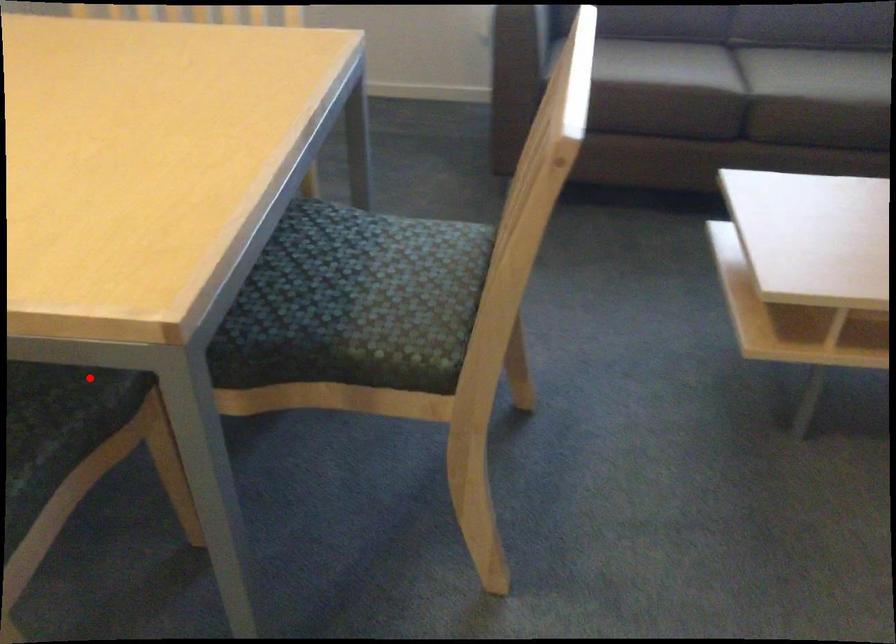
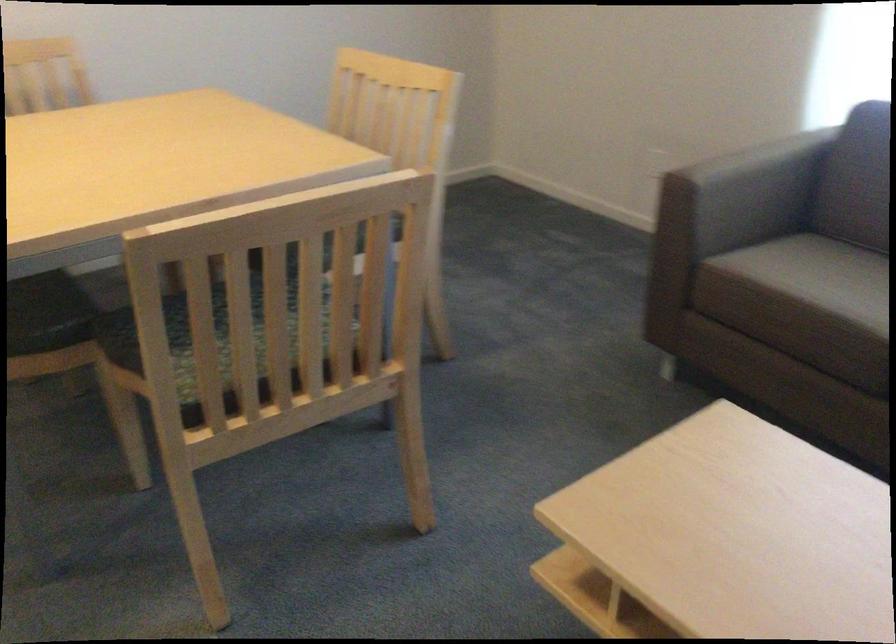
Question: I am providing you with two images of the same scene from different viewpoints. A red point is marked on the first image. Can you still see the location of the red point in image 2?

Choices:
 (A) Yes
 (B) No

Answer: (A)